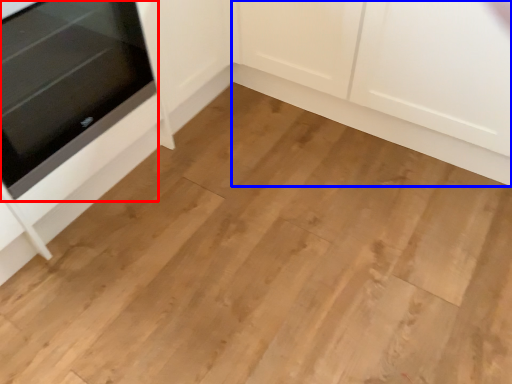
Question: Which point is closer to the camera, oven (highlighted by a red box) or cabinetry (highlighted by a blue box)?

Choices:
 (A) oven
 (B) cabinetry

Answer: (A)